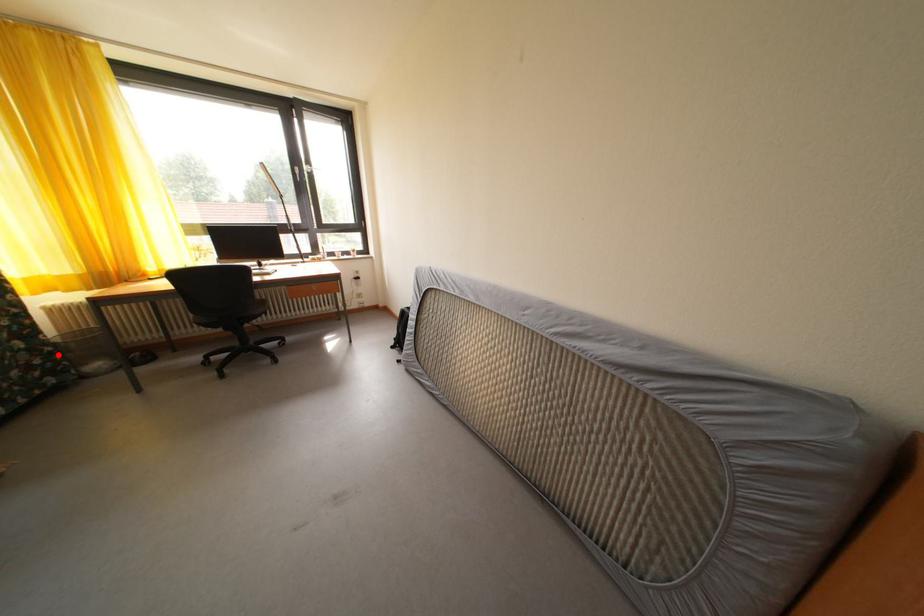
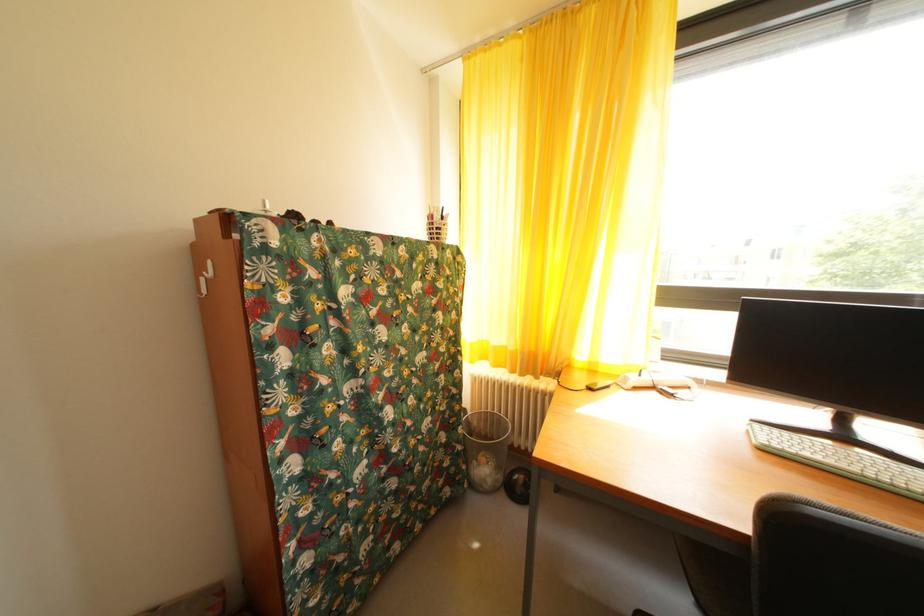
Question: I am providing you with two images of the same scene from different viewpoints. Given a red point in image1, look at the same physical point in image2. Is it:

Choices:
 (A) Closer to the viewpoint
 (B) Farther from the viewpoint

Answer: (A)